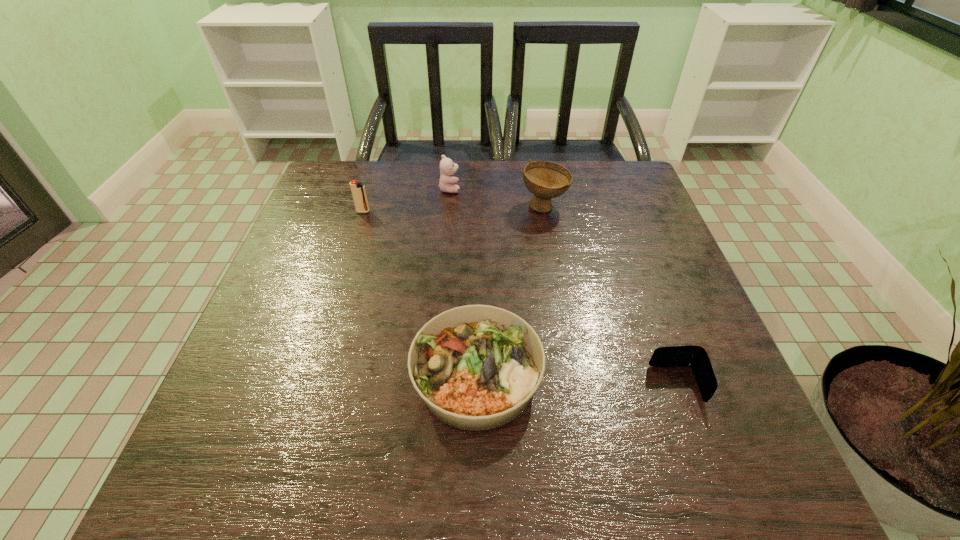
Locate an element on the screen. free area in between the shortest object and the igniter is located at coordinates (519, 298).

Identify the location of free space between the teddy bear and the soup bowl. (497, 198).

The width and height of the screenshot is (960, 540). Find the location of `vacant area that lies between the igniter and the rightmost object`. vacant area that lies between the igniter and the rightmost object is located at coordinates (519, 298).

Identify the location of object that is the closest to the igniter. (447, 167).

Locate which object ranks third in proximity to the leftmost object. Please provide its 2D coordinates. Your answer should be formatted as a tuple, i.e. [(x, y)], where the tuple contains the x and y coordinates of a point satisfying the conditions above.

[(476, 367)]

The width and height of the screenshot is (960, 540). Identify the location of vacant space that satisfies the following two spatial constraints: 1. at the face of the teddy bear; 2. on the front side of the igniter. (447, 212).

The width and height of the screenshot is (960, 540). I want to click on vacant region that satisfies the following two spatial constraints: 1. on the back side of the soup bowl; 2. at the face of the teddy bear, so click(x=541, y=188).

The image size is (960, 540). What are the coordinates of `vacant region that satisfies the following two spatial constraints: 1. at the face of the salad plate; 2. on the right side of the teddy bear` in the screenshot? It's located at (434, 376).

Where is `vacant point that satisfies the following two spatial constraints: 1. at the face of the teddy bear; 2. on the front side of the igniter`? Image resolution: width=960 pixels, height=540 pixels. vacant point that satisfies the following two spatial constraints: 1. at the face of the teddy bear; 2. on the front side of the igniter is located at coordinates (447, 212).